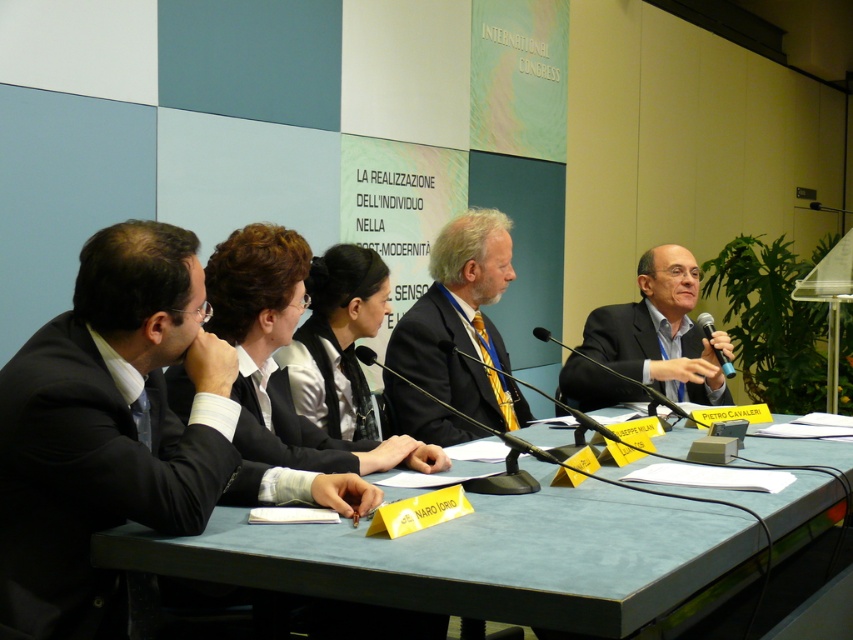
Question: Does smooth gray table at center come behind black plastic microphone at right?

Choices:
 (A) yes
 (B) no

Answer: (B)

Question: Which point is closer to the camera taking this photo?

Choices:
 (A) (67, 497)
 (B) (703, 330)
 (C) (468, 396)

Answer: (A)

Question: Observing the image, what is the correct spatial positioning of matte black suit at center in reference to white satin blouse at center?

Choices:
 (A) right
 (B) left

Answer: (A)

Question: Does smooth gray table at center appear on the left side of black matte suit at center?

Choices:
 (A) yes
 (B) no

Answer: (A)

Question: Which point is farther to the camera?

Choices:
 (A) (724, 563)
 (B) (318, 349)
 (C) (223, 445)
 (D) (708, 339)

Answer: (D)

Question: Estimate the real-world distances between objects in this image. Which object is closer to the smooth gray table at center?

Choices:
 (A) black plastic microphone at center
 (B) white satin blouse at center
 (C) black matte suit at center

Answer: (A)